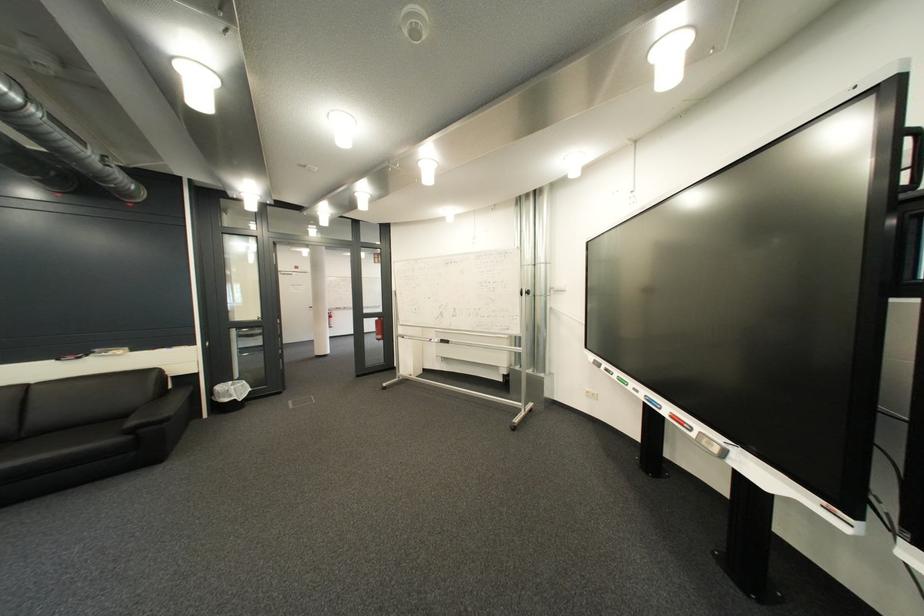
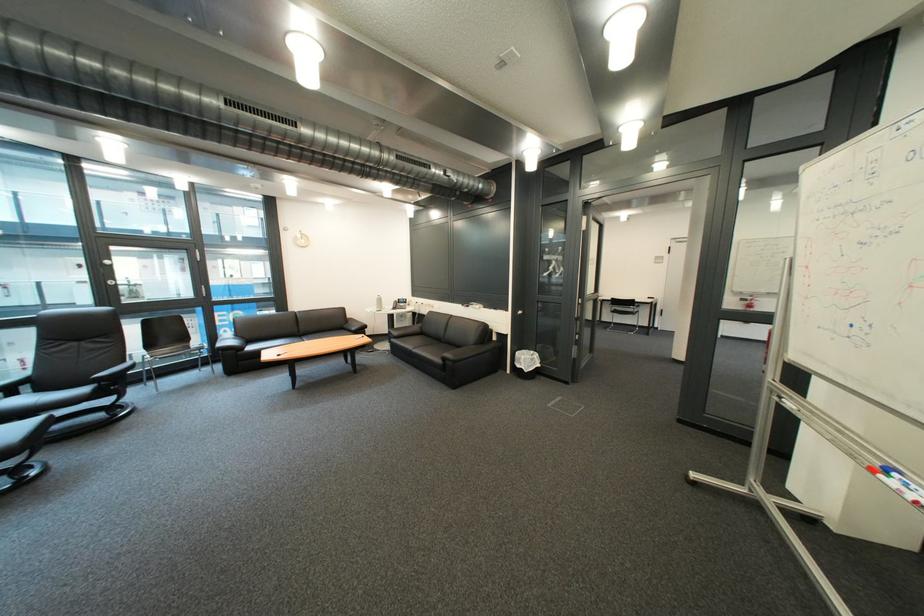
The point at (x=253, y=350) is marked in the first image. Where is the corresponding point in the second image?

(628, 325)